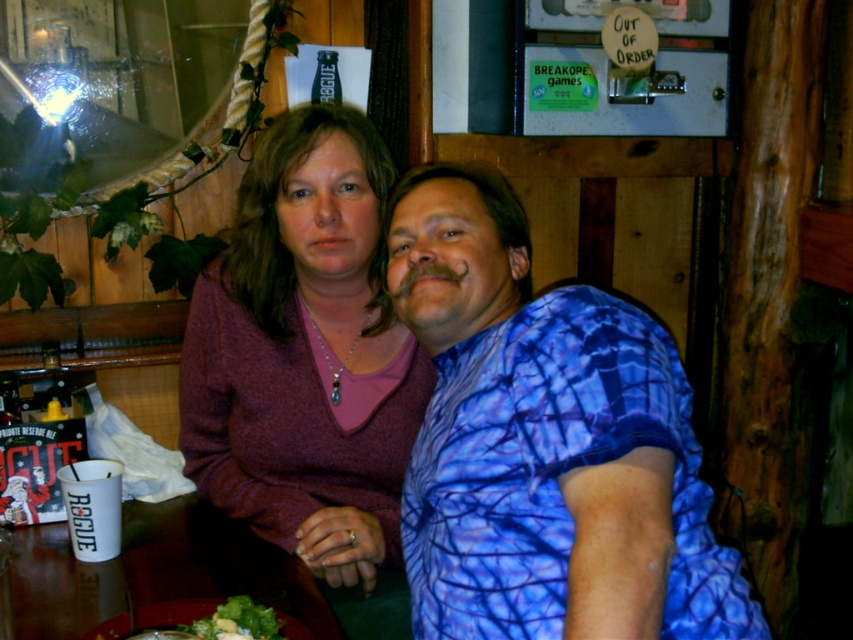
Question: Does blue tie-dye shirt at center come behind matte purple sweater at center?

Choices:
 (A) no
 (B) yes

Answer: (A)

Question: Which of the following is the closest to the observer?

Choices:
 (A) wooden table at lower center
 (B) green leafy salad at lower center
 (C) blue tie-dye shirt at center
 (D) matte purple sweater at center

Answer: (C)

Question: Based on their relative distances, which object is nearer to the blue tie-dye shirt at center?

Choices:
 (A) green leafy salad at lower center
 (B) matte purple sweater at center
 (C) wooden table at lower center

Answer: (B)

Question: Is blue tie-dye shirt at center below matte purple sweater at center?

Choices:
 (A) no
 (B) yes

Answer: (B)

Question: Among these points, which one is farthest from the camera?

Choices:
 (A) (320, 628)
 (B) (218, 616)
 (C) (387, 531)

Answer: (C)

Question: Is blue tie-dye shirt at center wider than matte purple sweater at center?

Choices:
 (A) no
 (B) yes

Answer: (B)